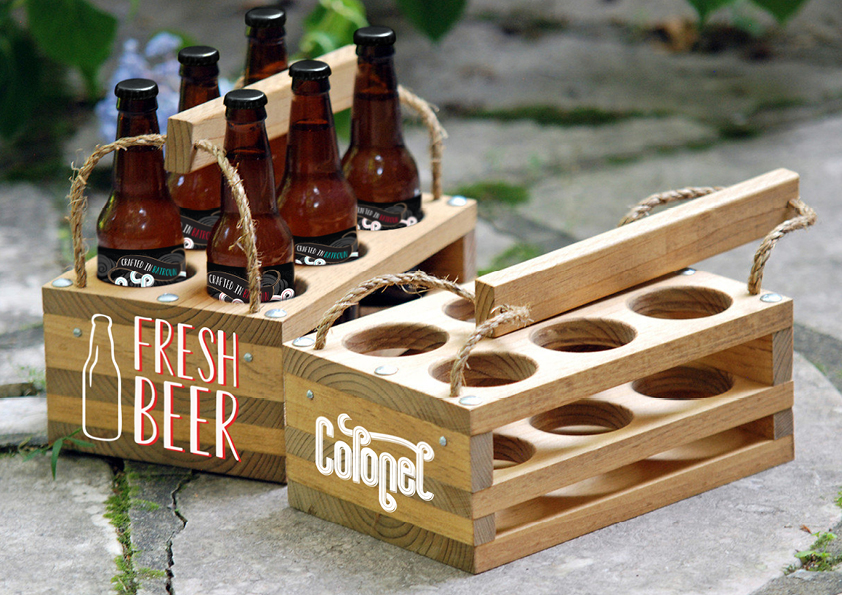
You are a GUI agent. You are given a task and a screenshot of the screen. Output one action in this format:
    pyautogui.click(x=<x>, y=<y>)
    Task: Click on the bottle
    Image resolution: width=842 pixels, height=595 pixels.
    Given the screenshot: What is the action you would take?
    pyautogui.click(x=104, y=380)